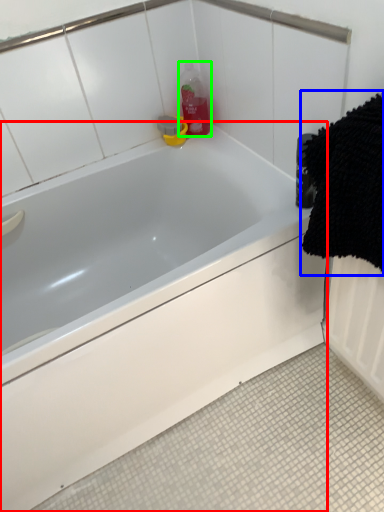
Question: Which object is the farthest from bathtub (highlighted by a red box)? Choose among these: bath towel (highlighted by a blue box) or cleaning product (highlighted by a green box).

Choices:
 (A) bath towel
 (B) cleaning product

Answer: (B)